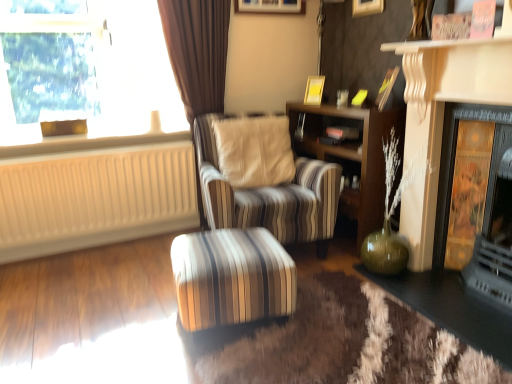
What do you see at coordinates (481, 203) in the screenshot? This screenshot has width=512, height=384. I see `gold textured panel at right` at bounding box center [481, 203].

What is the approximate height of beige ribbed radiator at left?

The height of beige ribbed radiator at left is 23.35 inches.

Describe the element at coordinates (367, 7) in the screenshot. Image resolution: width=512 pixels, height=384 pixels. I see `matte gold picture frame at upper center, the first picture frame positioned from the right` at that location.

What do you see at coordinates (92, 73) in the screenshot? Image resolution: width=512 pixels, height=384 pixels. I see `transparent glass window at upper left` at bounding box center [92, 73].

This screenshot has height=384, width=512. What are the coordinates of `gold textured panel at right` in the screenshot? It's located at (481, 203).

What's the angular difference between wooden picture frame at upper center, which is counted as the 2th picture frame, starting from the bottom, and green glass vase at lower right, which ranks as the first table in right-to-left order,'s facing directions?

90.4 degrees.

Could you measure the distance between wooden picture frame at upper center, which is counted as the 2th picture frame, starting from the bottom, and green glass vase at lower right, the 2th table from the left?

They are 6.95 feet apart.

Is wooden picture frame at upper center, acting as the second picture frame starting from the top, bigger than green glass vase at lower right, which ranks as the first table in right-to-left order?

Incorrect, wooden picture frame at upper center, acting as the second picture frame starting from the top, is not larger than green glass vase at lower right, which ranks as the first table in right-to-left order.

The height and width of the screenshot is (384, 512). There is a wooden picture frame at upper center, acting as the second picture frame starting from the top. In order to click on the 2nd table below it (from a real-world perspective) in this screenshot , I will do `click(452, 308)`.

Can matte yellow picture frame at upper center, which is counted as the third picture frame, starting from the top, be found inside wooden picture frame at upper center, acting as the second picture frame starting from the top?

No, wooden picture frame at upper center, acting as the second picture frame starting from the top, does not contain matte yellow picture frame at upper center, which is counted as the third picture frame, starting from the top.

Locate an element on the screen. This screenshot has width=512, height=384. picture frame that is the 1st object located above the matte yellow picture frame at upper center, which appears as the second picture frame when viewed from the left (from the image's perspective) is located at coordinates (271, 6).

In the scene shown: From the image's perspective, is wooden picture frame at upper center, which ranks as the 1th picture frame in left-to-right order, on top of matte yellow picture frame at upper center, which is counted as the third picture frame, starting from the top?

Yes, from the image's perspective, wooden picture frame at upper center, which ranks as the 1th picture frame in left-to-right order, is over matte yellow picture frame at upper center, which is counted as the third picture frame, starting from the top.

Is matte yellow picture frame at upper center, which is counted as the third picture frame, starting from the top, far away from wooden picture frame at upper center, which is counted as the 2th picture frame, starting from the bottom?

No, matte yellow picture frame at upper center, which is counted as the third picture frame, starting from the top, is not far away from wooden picture frame at upper center, which is counted as the 2th picture frame, starting from the bottom.

Where is `the 1st picture frame to the right of the wooden picture frame at upper center, which is counted as the 2th picture frame, starting from the bottom, counting from the anchor's position`? The height and width of the screenshot is (384, 512). the 1st picture frame to the right of the wooden picture frame at upper center, which is counted as the 2th picture frame, starting from the bottom, counting from the anchor's position is located at coordinates (314, 90).

Who is smaller, matte yellow picture frame at upper center, which appears as the first picture frame when ordered from the bottom, or wooden picture frame at upper center, acting as the second picture frame starting from the top?

matte yellow picture frame at upper center, which appears as the first picture frame when ordered from the bottom.

How different are the orientations of matte yellow picture frame at upper center, which appears as the second picture frame when viewed from the left, and wooden picture frame at upper center, which ranks as the 1th picture frame in left-to-right order, in degrees?

They differ by 55 degrees in their facing directions.

Which of these two, striped fabric chair at center or beige ribbed radiator at left, is bigger?

striped fabric chair at center.

Relative to beige ribbed radiator at left, is striped fabric chair at center in front or behind?

striped fabric chair at center is positioned closer to the viewer than beige ribbed radiator at left.

Considering the relative positions of striped fabric chair at center and beige ribbed radiator at left in the image provided, is striped fabric chair at center to the left of beige ribbed radiator at left from the viewer's perspective?

No, striped fabric chair at center is not to the left of beige ribbed radiator at left.

From their relative heights in the image, would you say beige ribbed radiator at left is taller or shorter than matte gold picture frame at upper center, the third picture frame positioned from the bottom?

beige ribbed radiator at left is taller than matte gold picture frame at upper center, the third picture frame positioned from the bottom.

From a real-world perspective, is beige ribbed radiator at left beneath matte gold picture frame at upper center, the 3th picture frame viewed from the left?

Indeed, from a real-world perspective, beige ribbed radiator at left is positioned beneath matte gold picture frame at upper center, the 3th picture frame viewed from the left.

From the image's perspective, which is above, beige ribbed radiator at left or matte gold picture frame at upper center, the first picture frame positioned from the right?

matte gold picture frame at upper center, the first picture frame positioned from the right, from the image's perspective.

Locate an element on the screen. The width and height of the screenshot is (512, 384). the 1st picture frame counting from the right of the striped fabric ottoman at center, arranged as the second table when viewed from the right is located at coordinates (271, 6).

Which object is further away from the camera, striped fabric ottoman at center, arranged as the second table when viewed from the right, or wooden picture frame at upper center, which ranks as the 1th picture frame in left-to-right order?

Positioned behind is wooden picture frame at upper center, which ranks as the 1th picture frame in left-to-right order.

Is striped fabric ottoman at center, arranged as the second table when viewed from the right, smaller than wooden picture frame at upper center, marked as the 3th picture frame in a right-to-left arrangement?

Incorrect, striped fabric ottoman at center, arranged as the second table when viewed from the right, is not smaller in size than wooden picture frame at upper center, marked as the 3th picture frame in a right-to-left arrangement.

Does striped fabric ottoman at center, which is the 1th table in left-to-right order, touch wooden picture frame at upper center, which ranks as the 1th picture frame in left-to-right order?

No, striped fabric ottoman at center, which is the 1th table in left-to-right order, is not in contact with wooden picture frame at upper center, which ranks as the 1th picture frame in left-to-right order.

Could you tell me if matte gold picture frame at upper center, the first picture frame positioned from the right, is turned towards wooden picture frame at upper center, acting as the second picture frame starting from the top?

No, matte gold picture frame at upper center, the first picture frame positioned from the right, is not aimed at wooden picture frame at upper center, acting as the second picture frame starting from the top.

Is matte gold picture frame at upper center, the first picture frame positioned from the right, not within wooden picture frame at upper center, marked as the 3th picture frame in a right-to-left arrangement?

matte gold picture frame at upper center, the first picture frame positioned from the right, lies outside wooden picture frame at upper center, marked as the 3th picture frame in a right-to-left arrangement,'s area.

Can you tell me how much matte gold picture frame at upper center, the first picture frame positioned from the right, and wooden picture frame at upper center, acting as the second picture frame starting from the top, differ in facing direction?

93 degrees separate the facing orientations of matte gold picture frame at upper center, the first picture frame positioned from the right, and wooden picture frame at upper center, acting as the second picture frame starting from the top.

This screenshot has width=512, height=384. Identify the location of the 3rd picture frame behind the green glass vase at lower right, which ranks as the first table in right-to-left order. (271, 6).

Identify the location of picture frame that is the 1st one when counting upward from the matte yellow picture frame at upper center, which is counted as the third picture frame, starting from the top (from the image's perspective). Image resolution: width=512 pixels, height=384 pixels. (271, 6).

When comparing their distances from gold textured panel at right, does matte gold picture frame at upper center, the 3th picture frame viewed from the left, or transparent glass window at upper left seem further?

Based on the image, transparent glass window at upper left appears to be further to gold textured panel at right.

Estimate the real-world distances between objects in this image. Which object is closer to matte gold picture frame at upper center, arranged as the first picture frame when viewed from the top, striped fabric ottoman at center, which is the 1th table in left-to-right order, or wooden bookshelf at center?

wooden bookshelf at center lies closer to matte gold picture frame at upper center, arranged as the first picture frame when viewed from the top, than the other object.

When comparing their distances from wooden picture frame at upper center, which is counted as the 2th picture frame, starting from the bottom, does wooden bookshelf at center or striped fabric ottoman at center, which is the 1th table in left-to-right order, seem closer?

Based on the image, wooden bookshelf at center appears to be nearer to wooden picture frame at upper center, which is counted as the 2th picture frame, starting from the bottom.

Considering their positions, is striped fabric chair at center positioned closer to beige ribbed radiator at left than matte gold picture frame at upper center, arranged as the first picture frame when viewed from the top?

striped fabric chair at center.

Based on their spatial positions, is matte gold picture frame at upper center, the third picture frame positioned from the bottom, or wooden picture frame at upper center, which is counted as the 2th picture frame, starting from the bottom, closer to striped fabric chair at center?

wooden picture frame at upper center, which is counted as the 2th picture frame, starting from the bottom, lies closer to striped fabric chair at center than the other object.

From the image, which object appears to be nearer to gold textured panel at right, transparent glass window at upper left or wooden picture frame at upper center, acting as the second picture frame starting from the top?

The object closer to gold textured panel at right is wooden picture frame at upper center, acting as the second picture frame starting from the top.

Considering their positions, is transparent glass window at upper left positioned closer to striped fabric chair at center than gold textured panel at right?

Based on the image, transparent glass window at upper left appears to be nearer to striped fabric chair at center.

Looking at this image, from the image, which object appears to be farther from beige ribbed radiator at left, matte yellow picture frame at upper center, which appears as the second picture frame when viewed from the left, or striped fabric ottoman at center, which is the 1th table in left-to-right order?

Based on the image, matte yellow picture frame at upper center, which appears as the second picture frame when viewed from the left, appears to be further to beige ribbed radiator at left.

This screenshot has height=384, width=512. Identify the location of window between wooden picture frame at upper center, acting as the second picture frame starting from the top, and striped fabric ottoman at center, which is the 1th table in left-to-right order, in the up-down direction. (92, 73).

Identify the location of shelf positioned between striped fabric ottoman at center, which is the 1th table in left-to-right order, and matte yellow picture frame at upper center, which is counted as the third picture frame, starting from the top, from near to far. The width and height of the screenshot is (512, 384). (352, 155).

Find the location of a particular element. shelf between wooden picture frame at upper center, marked as the 3th picture frame in a right-to-left arrangement, and striped fabric chair at center, in the vertical direction is located at coordinates (352, 155).

You are a GUI agent. You are given a task and a screenshot of the screen. Output one action in this format:
    pyautogui.click(x=<x>, y=<y>)
    Task: Click on the radiator between wooden picture frame at upper center, which ranks as the 1th picture frame in left-to-right order, and striped fabric ottoman at center, which is the 1th table in left-to-right order, from top to bottom
    This screenshot has width=512, height=384.
    Given the screenshot: What is the action you would take?
    pyautogui.click(x=94, y=198)